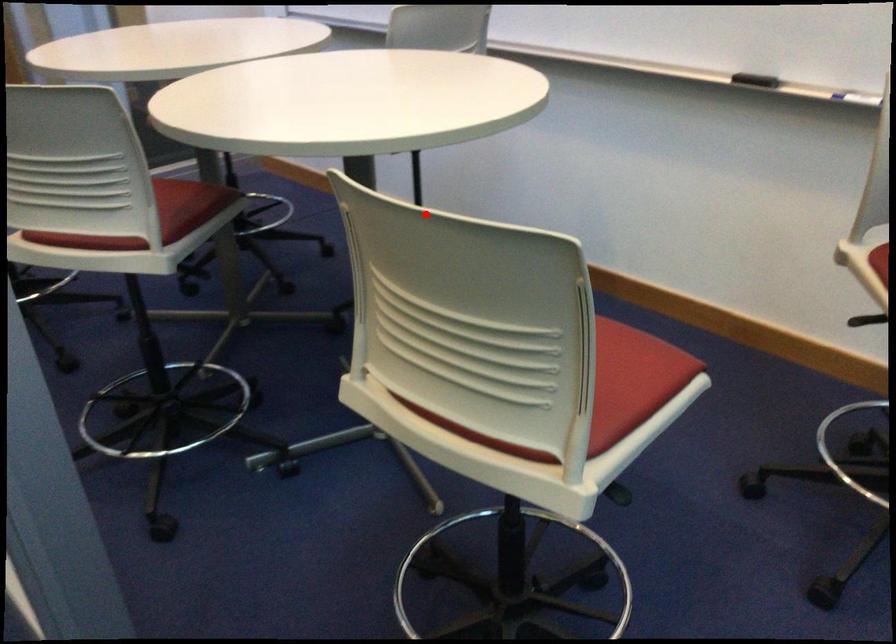
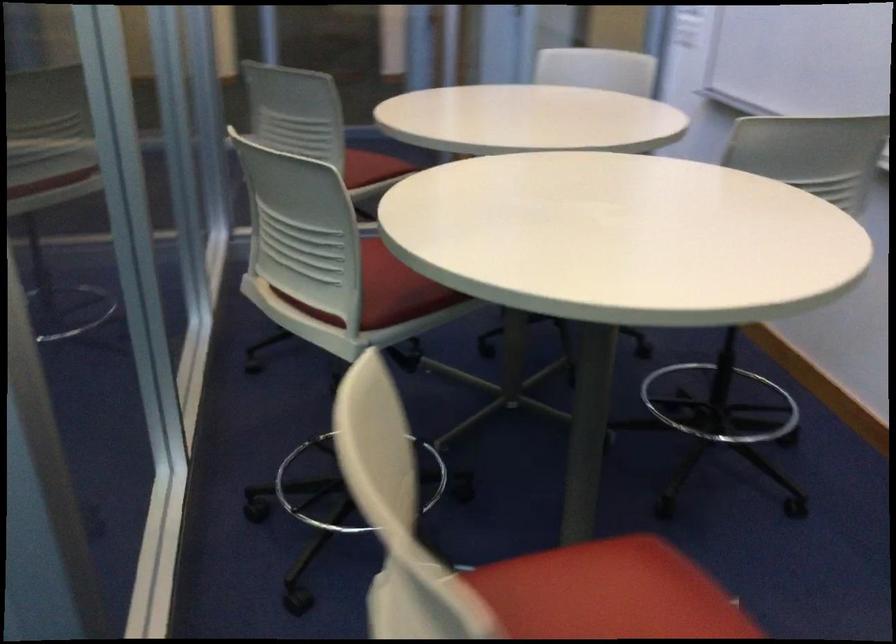
The point at the highlighted location is marked in the first image. Where is the corresponding point in the second image?

(348, 487)